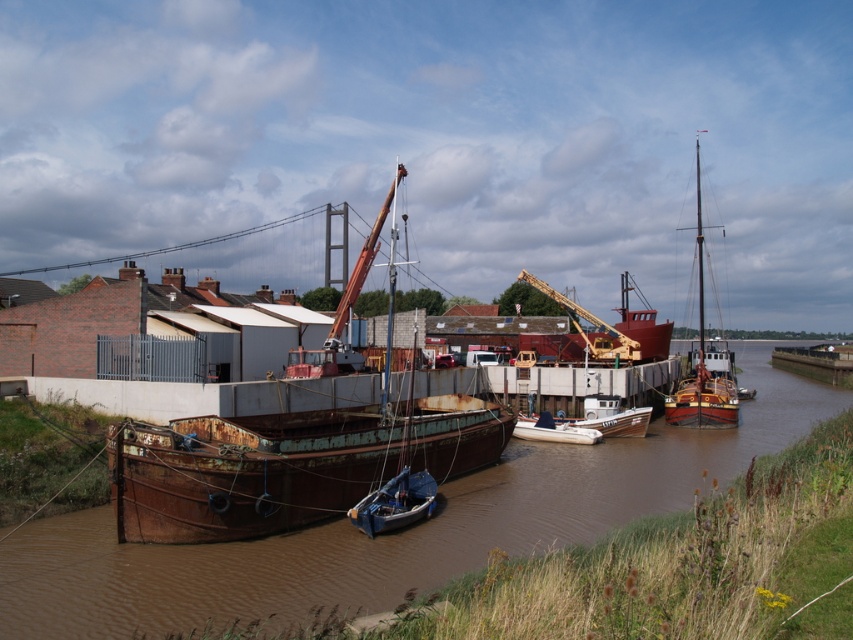
Question: Estimate the real-world distances between objects in this image. Which object is closer to the white plastic boat at center?

Choices:
 (A) metallic yellow crane at center
 (B) rustic wooden sailboat at right
 (C) white matte boat at center
 (D) rusty metal barge at center

Answer: (C)

Question: Does brown rusted water at center appear on the left side of white matte boat at center?

Choices:
 (A) no
 (B) yes

Answer: (A)

Question: Does metallic yellow crane at center have a smaller size compared to white matte boat at center?

Choices:
 (A) no
 (B) yes

Answer: (A)

Question: Among these points, which one is farthest from the camera?

Choices:
 (A) (573, 323)
 (B) (469, 477)

Answer: (A)

Question: Which point is farther to the camera?

Choices:
 (A) (242, 467)
 (B) (567, 433)
 (C) (693, 397)
 (D) (595, 424)

Answer: (C)

Question: Can you confirm if rustic wooden sailboat at right is thinner than metallic yellow crane at center?

Choices:
 (A) yes
 (B) no

Answer: (B)